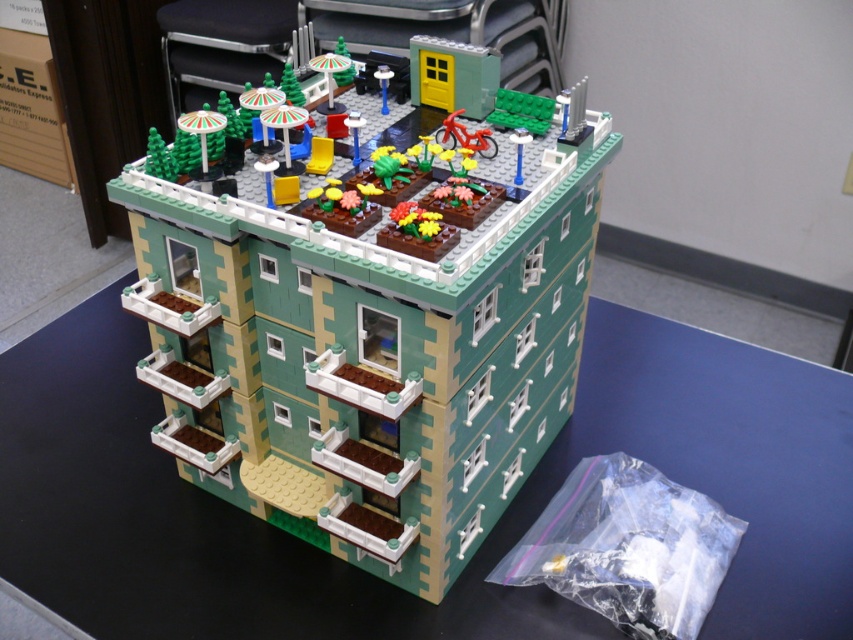
Question: Is green matte building at center to the right of green plastic table at center from the viewer's perspective?

Choices:
 (A) yes
 (B) no

Answer: (A)

Question: Among these points, which one is farthest from the camera?

Choices:
 (A) (521, 477)
 (B) (80, 449)

Answer: (B)

Question: Does green matte building at center appear under green plastic table at center?

Choices:
 (A) no
 (B) yes

Answer: (A)

Question: Which point appears closest to the camera in this image?

Choices:
 (A) (100, 627)
 (B) (509, 300)

Answer: (B)

Question: Which point is closer to the camera?

Choices:
 (A) green matte building at center
 (B) green plastic table at center

Answer: (A)

Question: Considering the relative positions of green matte building at center and green plastic table at center in the image provided, where is green matte building at center located with respect to green plastic table at center?

Choices:
 (A) left
 (B) right

Answer: (B)